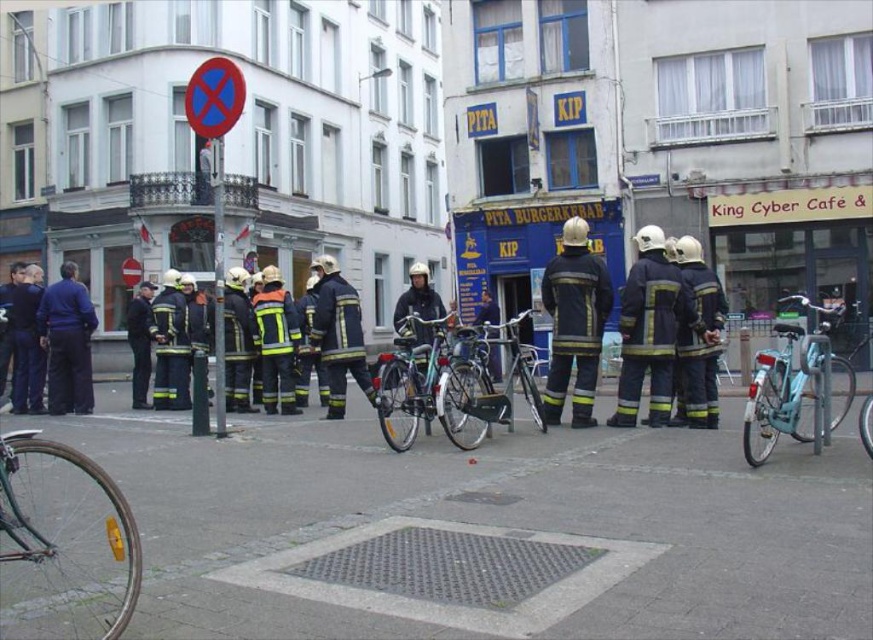
You are a drone operator trying to capture aerial footage of the urban street scene. You need to adjust your drone to focus on the two points marked in the image. Which point, point 1 at coordinates (x=478, y=444) or point 2 at coordinates (x=203, y=86), is closer to your drone camera?

Point 1 at coordinates (x=478, y=444) is closer to the camera than point 2 at coordinates (x=203, y=86).

You are a delivery person who needs to choose between the shiny silver bicycle at center and the shiny metallic bicycle at center to deliver packages efficiently. Which bicycle should you choose based on their height?

The shiny silver bicycle at center is not as tall as the shiny metallic bicycle at center. Therefore, the shiny metallic bicycle at center is taller and may be more suitable for carrying heavier packages due to its height, making it a better choice for efficient deliveries.

You are a delivery person who needs to park your bicycle at the exact coordinates provided in the scene. The scene shows a light blue metallic bicycle at lower right. What are the coordinates where you should park your bicycle?

The coordinates for the light blue metallic bicycle at lower right are at point (796,385).